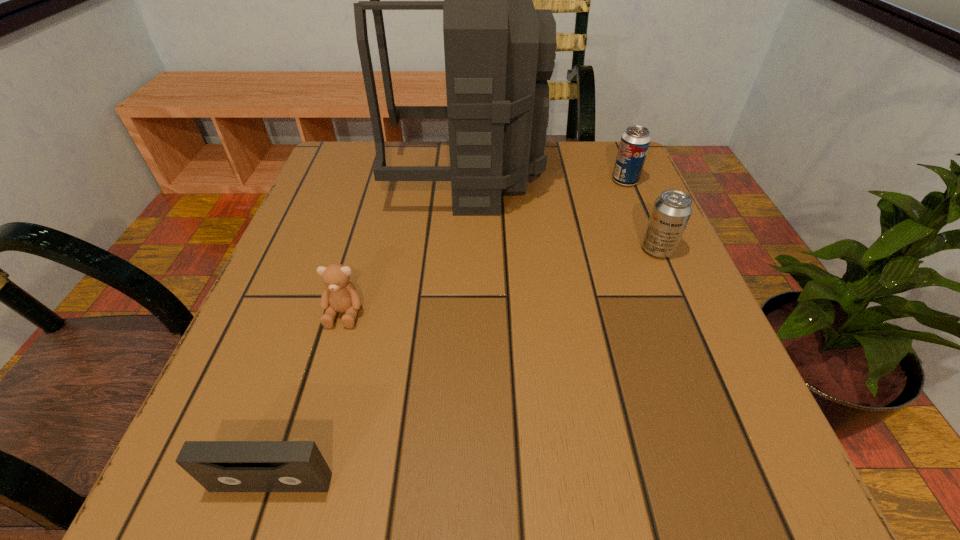
At what (x,y) coordinates should I click in order to perform the action: click on beer can located in the far edge section of the desktop. Please return your answer as a coordinate pair (x, y). Looking at the image, I should click on (635, 141).

Find the location of `object situated at the near edge`. object situated at the near edge is located at coordinates (219, 466).

This screenshot has height=540, width=960. Identify the location of teddy bear that is at the left edge. pos(340,295).

Where is `videotape that is at the left edge`? Image resolution: width=960 pixels, height=540 pixels. videotape that is at the left edge is located at coordinates (219, 466).

Where is `object at the near left corner`? object at the near left corner is located at coordinates (219, 466).

This screenshot has width=960, height=540. I want to click on object located in the far right corner section of the desktop, so click(635, 141).

The width and height of the screenshot is (960, 540). In the image, there is a desktop. What are the coordinates of `vacant space at the far edge` in the screenshot? It's located at (431, 162).

The height and width of the screenshot is (540, 960). Find the location of `free space at the near edge of the desktop`. free space at the near edge of the desktop is located at coordinates (432, 491).

Where is `free space at the left edge`? The image size is (960, 540). free space at the left edge is located at coordinates (353, 210).

This screenshot has width=960, height=540. In the image, there is a desktop. What are the coordinates of `free space at the right edge` in the screenshot? It's located at (741, 417).